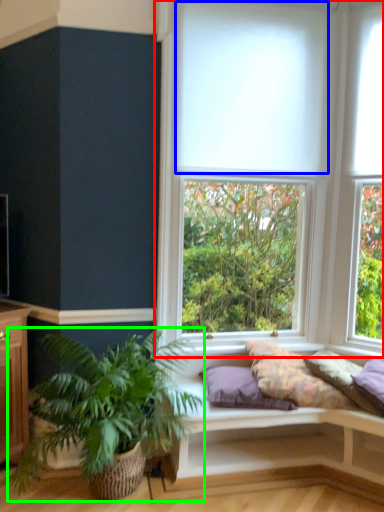
Question: Considering the real-world distances, which object is farthest from window (highlighted by a red box)? blind (highlighted by a blue box) or houseplant (highlighted by a green box)?

Choices:
 (A) blind
 (B) houseplant

Answer: (B)